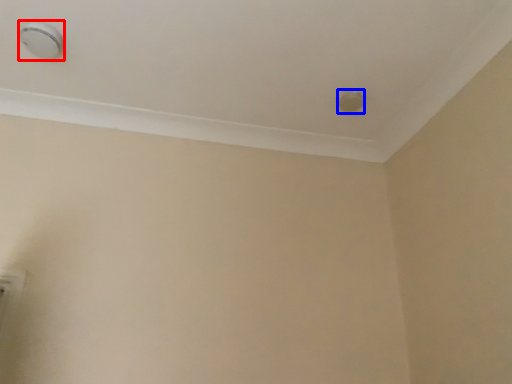
Question: Which object appears closest to the camera in this image, knob (highlighted by a red box) or knob (highlighted by a blue box)?

Choices:
 (A) knob
 (B) knob

Answer: (A)